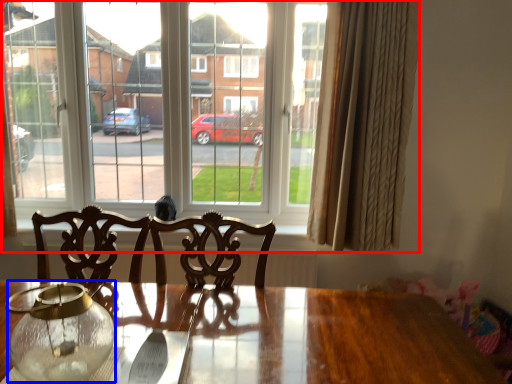
Question: Which point is further to the camera, window (highlighted by a red box) or glass vase (highlighted by a blue box)?

Choices:
 (A) window
 (B) glass vase

Answer: (A)